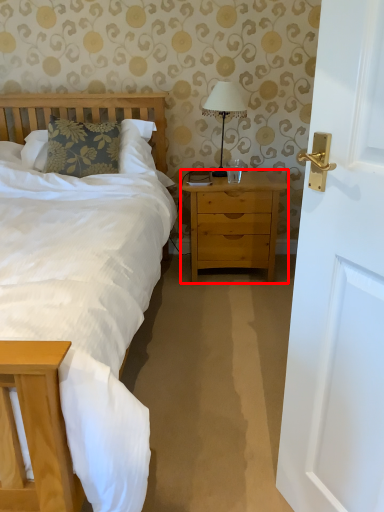
Question: From the image's perspective, considering the relative positions of nightstand (annotated by the red box) and bedside lamp in the image provided, where is nightstand (annotated by the red box) located with respect to the staircase?

Choices:
 (A) below
 (B) above

Answer: (A)